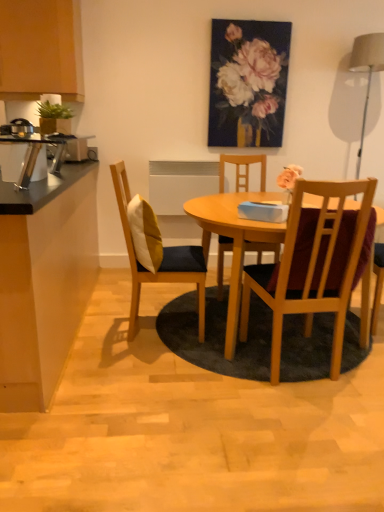
What do you see at coordinates (45, 289) in the screenshot? The height and width of the screenshot is (512, 384). I see `black laminate countertop at left` at bounding box center [45, 289].

Image resolution: width=384 pixels, height=512 pixels. I want to click on matte gray lampshade at upper right, so click(x=366, y=71).

Locate an element on the screen. The image size is (384, 512). black laminate countertop at left is located at coordinates (45, 289).

Between matte wood cabinet at upper left and pastel floral painting at upper center, which one has smaller width?

pastel floral painting at upper center is thinner.

Based on the photo, which object is positioned more to the right, matte wood cabinet at upper left or pastel floral painting at upper center?

From the viewer's perspective, pastel floral painting at upper center appears more on the right side.

Is matte wood cabinet at upper left not within pastel floral painting at upper center?

Absolutely, matte wood cabinet at upper left is external to pastel floral painting at upper center.

Which object is closer to the camera taking this photo, matte wood cabinet at upper left or pastel floral painting at upper center?

matte wood cabinet at upper left is in front.

Considering the points (20, 48) and (220, 181), which point is behind, point (20, 48) or point (220, 181)?

The point (220, 181) is farther.

Is matte wood cabinet at upper left at the left side of wooden chair at center, the 2th chair when ordered from left to right?

Indeed, matte wood cabinet at upper left is positioned on the left side of wooden chair at center, the 2th chair when ordered from left to right.

Is matte wood cabinet at upper left oriented towards wooden chair at center, which is counted as the second chair, starting from the right?

No.

Considering the relative sizes of matte wood cabinet at upper left and wooden chair at center, the 2th chair when ordered from left to right, in the image provided, is matte wood cabinet at upper left taller than wooden chair at center, the 2th chair when ordered from left to right,?

No, matte wood cabinet at upper left is not taller than wooden chair at center, the 2th chair when ordered from left to right.

From their relative heights in the image, would you say wooden chair at center, the third chair viewed from the left, is taller or shorter than yellow fabric pillow at left?

Considering their sizes, wooden chair at center, the third chair viewed from the left, has more height than yellow fabric pillow at left.

Locate an element on the screen. pillow on the left of wooden chair at center, which is the 1th chair in right-to-left order is located at coordinates (145, 234).

From the picture: Which object is positioned more to the right, wooden chair at center, the third chair viewed from the left, or yellow fabric pillow at left?

wooden chair at center, the third chair viewed from the left.

Is wooden chair at center, the third chair viewed from the left, smaller than yellow fabric pillow at left?

No, wooden chair at center, the third chair viewed from the left, is not smaller than yellow fabric pillow at left.

From the image's perspective, between wooden chair at center, which is the 1th chair in right-to-left order, and wooden chair with cushion at center, the 3th chair from the right, who is located below?

wooden chair at center, which is the 1th chair in right-to-left order, from the image's perspective.

Considering the relative positions of wooden chair at center, which is the 1th chair in right-to-left order, and wooden chair with cushion at center, the 3th chair from the right, in the image provided, is wooden chair at center, which is the 1th chair in right-to-left order, in front of wooden chair with cushion at center, the 3th chair from the right,?

Yes, it is.

Is wooden chair with cushion at center, the 3th chair from the right, inside wooden chair at center, which is the 1th chair in right-to-left order?

Definitely not — wooden chair with cushion at center, the 3th chair from the right, is not inside wooden chair at center, which is the 1th chair in right-to-left order.

In terms of height, does wooden chair at center, which is the 1th chair in right-to-left order, look taller or shorter compared to wooden chair with cushion at center, which is counted as the first chair, starting from the left?

Considering their sizes, wooden chair at center, which is the 1th chair in right-to-left order, has less height than wooden chair with cushion at center, which is counted as the first chair, starting from the left.

Is brushed metal toaster at left, the 1th appliance positioned from the left, to the left or to the right of wooden chair at center, the third chair viewed from the left, in the image?

Based on their positions, brushed metal toaster at left, the 1th appliance positioned from the left, is located to the left of wooden chair at center, the third chair viewed from the left.

Considering the sizes of objects brushed metal toaster at left, the first appliance positioned from the back, and wooden chair at center, which is the 1th chair in right-to-left order, in the image provided, who is smaller, brushed metal toaster at left, the first appliance positioned from the back, or wooden chair at center, which is the 1th chair in right-to-left order,?

brushed metal toaster at left, the first appliance positioned from the back.

Between point (75, 142) and point (316, 260), which one is positioned behind?

The point (75, 142) is farther.

Can you see brushed metal toaster at left, placed as the 1th appliance when sorted from top to bottom, touching wooden chair at center, the third chair viewed from the left?

There is a gap between brushed metal toaster at left, placed as the 1th appliance when sorted from top to bottom, and wooden chair at center, the third chair viewed from the left.

Locate an element on the screen. The image size is (384, 512). pillow below the matte gray lampshade at upper right (from a real-world perspective) is located at coordinates (145, 234).

Is yellow fabric pillow at left to the left or to the right of matte gray lampshade at upper right in the image?

From the image, it's evident that yellow fabric pillow at left is to the left of matte gray lampshade at upper right.

Does yellow fabric pillow at left have a lesser height compared to matte gray lampshade at upper right?

Correct, yellow fabric pillow at left is not as tall as matte gray lampshade at upper right.

Is matte gray lampshade at upper right far away from brushed metal toaster at left, the 2th appliance in the right-to-left sequence?

Yes, matte gray lampshade at upper right is far from brushed metal toaster at left, the 2th appliance in the right-to-left sequence.

Is matte gray lampshade at upper right in front of or behind brushed metal toaster at left, the 2th appliance in the right-to-left sequence, in the image?

matte gray lampshade at upper right is positioned closer to the viewer than brushed metal toaster at left, the 2th appliance in the right-to-left sequence.

In terms of size, does matte gray lampshade at upper right appear bigger or smaller than brushed metal toaster at left, the 2th appliance in the right-to-left sequence?

Considering their sizes, matte gray lampshade at upper right takes up more space than brushed metal toaster at left, the 2th appliance in the right-to-left sequence.

From a real-world perspective, which object rests below the other?

brushed metal toaster at left, the 1th appliance positioned from the left, is physically lower.

Identify the location of cabinetry in front of the pastel floral painting at upper center. The width and height of the screenshot is (384, 512). (41, 49).

This screenshot has height=512, width=384. In order to click on cabinetry above the wooden chair at center, the 2th chair when ordered from left to right (from a real-world perspective) in this screenshot , I will do `click(41, 49)`.

Considering their positions, is wooden chair at center, the 2th chair when ordered from left to right, positioned further to matte wood cabinet at upper left than matte gray lampshade at upper right?

The object further to matte wood cabinet at upper left is matte gray lampshade at upper right.

From the image, which object appears to be farther from matte gray lampshade at upper right, black laminate countertop at left or wooden chair with cushion at center, which is counted as the first chair, starting from the left?

black laminate countertop at left.

Considering their positions, is wooden chair at center, the third chair viewed from the left, positioned further to wooden chair with cushion at center, which is counted as the first chair, starting from the left, than yellow fabric pillow at left?

wooden chair at center, the third chair viewed from the left, is positioned further to the anchor wooden chair with cushion at center, which is counted as the first chair, starting from the left.

From the image, which object appears to be nearer to matte wood cabinet at upper left, matte gray lampshade at upper right or wooden chair at center, which is counted as the second chair, starting from the right?

The object closer to matte wood cabinet at upper left is wooden chair at center, which is counted as the second chair, starting from the right.

Which object lies nearer to the anchor point metallic silver toaster at left, which ranks as the 2th appliance in left-to-right order, pastel floral painting at upper center or black laminate countertop at left?

black laminate countertop at left is positioned closer to the anchor metallic silver toaster at left, which ranks as the 2th appliance in left-to-right order.

From the image, which object appears to be farther from black laminate countertop at left, wooden chair with cushion at center, which is counted as the first chair, starting from the left, or metallic silver toaster at left, positioned as the first appliance in bottom-to-top order?

The object further to black laminate countertop at left is metallic silver toaster at left, positioned as the first appliance in bottom-to-top order.

From the image, which object appears to be farther from brushed metal toaster at left, marked as the second appliance in a front-to-back arrangement, black laminate countertop at left or matte wood cabinet at upper left?

black laminate countertop at left.

When comparing their distances from matte wood cabinet at upper left, does brushed metal toaster at left, the 1th appliance positioned from the left, or wooden chair with cushion at center, which is counted as the first chair, starting from the left, seem further?

wooden chair with cushion at center, which is counted as the first chair, starting from the left, is positioned further to the anchor matte wood cabinet at upper left.

This screenshot has height=512, width=384. Find the location of `chair between pastel floral painting at upper center and yellow fabric pillow at left in the up-down direction`. chair between pastel floral painting at upper center and yellow fabric pillow at left in the up-down direction is located at coordinates (243, 170).

Find the location of `pillow between black laminate countertop at left and pastel floral painting at upper center from front to back`. pillow between black laminate countertop at left and pastel floral painting at upper center from front to back is located at coordinates (145, 234).

Locate an element on the screen. chair between metallic silver toaster at left, which is the 1th appliance in right-to-left order, and wooden chair at center, which is counted as the second chair, starting from the right, from left to right is located at coordinates (162, 260).

Where is `pillow located between black laminate countertop at left and wooden chair with cushion at center, which is counted as the first chair, starting from the left, in the left-right direction`? The height and width of the screenshot is (512, 384). pillow located between black laminate countertop at left and wooden chair with cushion at center, which is counted as the first chair, starting from the left, in the left-right direction is located at coordinates (145, 234).